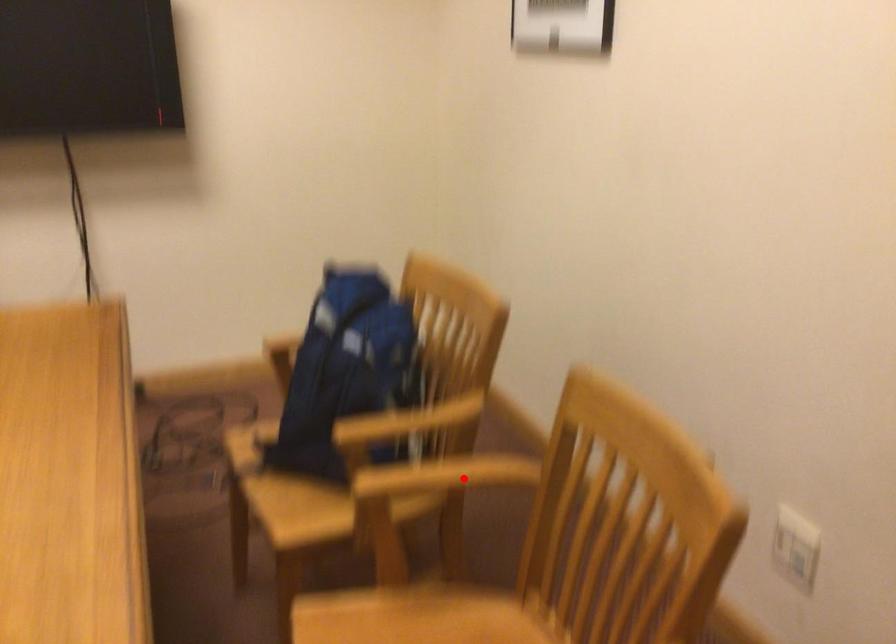
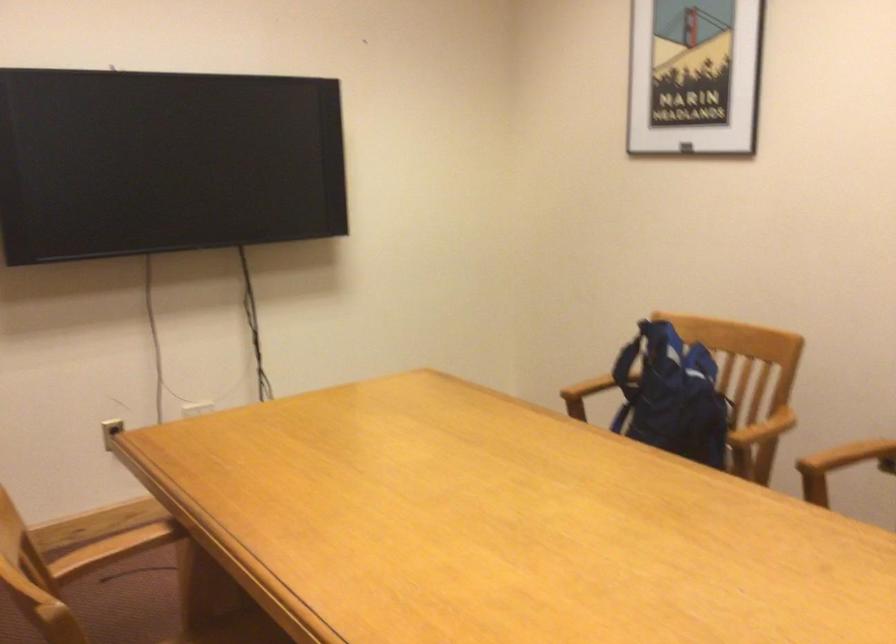
The point at the highlighted location is marked in the first image. Where is the corresponding point in the second image?

(849, 456)